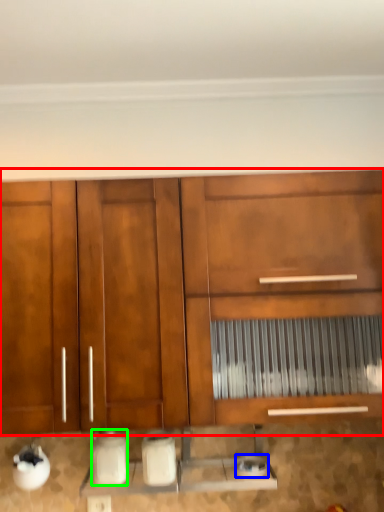
Question: Which object is the closest to the cabinetry (highlighted by a red box)? Choose among these: appliance (highlighted by a blue box) or appliance (highlighted by a green box).

Choices:
 (A) appliance
 (B) appliance

Answer: (B)